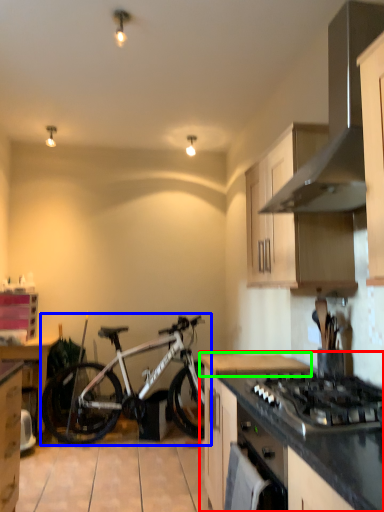
Question: Estimate the real-world distances between objects in this image. Which object is closer to countertop (highlighted by a red box), bicycle (highlighted by a blue box) or countertop (highlighted by a green box)?

Choices:
 (A) bicycle
 (B) countertop

Answer: (B)